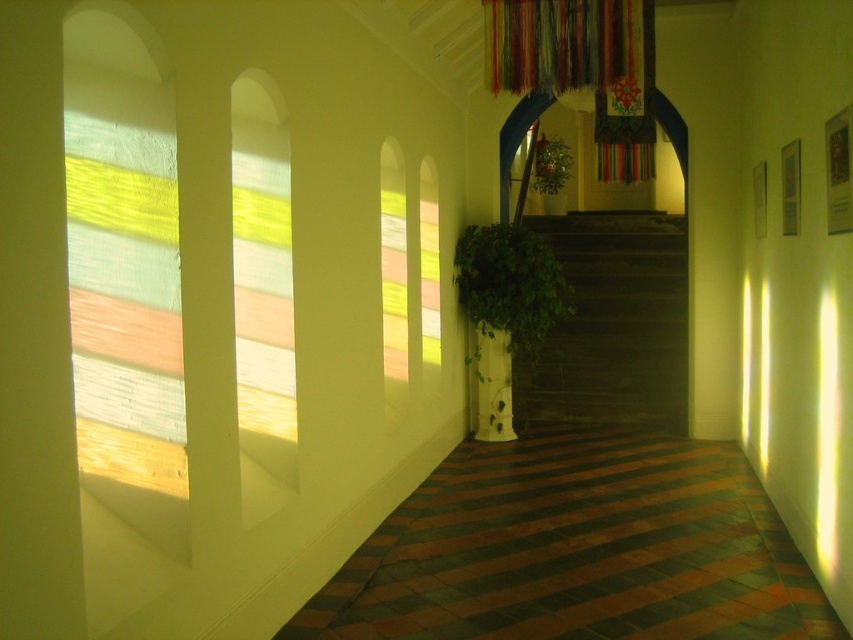
Question: Which object appears closest to the camera in this image?

Choices:
 (A) green leafy plant at center
 (B) dark wood stairs at center

Answer: (B)

Question: Which object is farther from the camera taking this photo?

Choices:
 (A) green glossy plant at center
 (B) multicolored fabric curtain at upper center
 (C) dark wood stairs at center

Answer: (C)

Question: Does dark wood stairs at center have a greater width compared to green glossy plant at center?

Choices:
 (A) no
 (B) yes

Answer: (B)

Question: Can you confirm if dark wood stairs at center is positioned above green leafy plant at center?

Choices:
 (A) yes
 (B) no

Answer: (B)

Question: Does dark wood stairs at center have a lesser width compared to multicolored fabric curtain at upper center?

Choices:
 (A) no
 (B) yes

Answer: (A)

Question: Estimate the real-world distances between objects in this image. Which object is closer to the green leafy plant at center?

Choices:
 (A) green glossy plant at center
 (B) dark wood stairs at center
 (C) multicolored fabric curtain at upper center

Answer: (B)